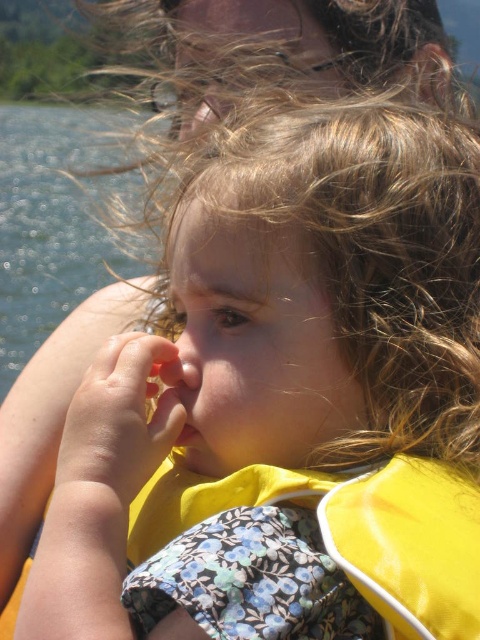
Question: Which of the following is the closest to the observer?

Choices:
 (A) yellow fabric life jacket at center
 (B) smooth flesh nose at center
 (C) clear water at left

Answer: (A)

Question: Which object is positioned farthest from the smooth flesh nose at center?

Choices:
 (A) clear water at left
 (B) yellow fabric life jacket at center

Answer: (A)

Question: Can you confirm if yellow fabric life jacket at center is smaller than clear water at left?

Choices:
 (A) no
 (B) yes

Answer: (B)

Question: Is yellow fabric life jacket at center closer to camera compared to smooth flesh nose at center?

Choices:
 (A) yes
 (B) no

Answer: (A)

Question: From the image, what is the correct spatial relationship of clear water at left in relation to smooth flesh nose at center?

Choices:
 (A) below
 (B) above

Answer: (B)

Question: Which of the following is the closest to the observer?

Choices:
 (A) (177, 340)
 (B) (1, 296)

Answer: (A)